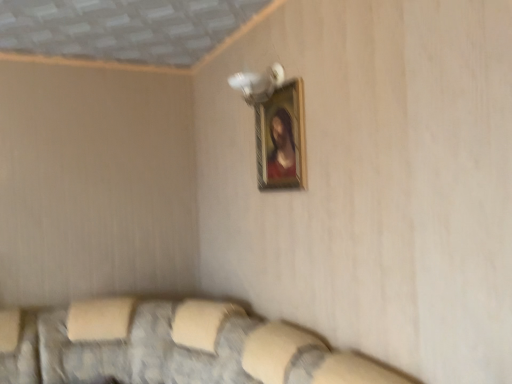
Describe the element at coordinates (281, 138) in the screenshot. I see `wooden frame at upper center` at that location.

Find the location of a particular element. wooden frame at upper center is located at coordinates (281, 138).

Locate an element on the screen. textured fabric couch at lower center is located at coordinates (172, 347).

Describe the element at coordinates (172, 347) in the screenshot. Image resolution: width=512 pixels, height=384 pixels. I see `textured fabric couch at lower center` at that location.

Where is `wooden frame at upper center`? The height and width of the screenshot is (384, 512). wooden frame at upper center is located at coordinates (281, 138).

Can you confirm if wooden frame at upper center is positioned to the left of textured fabric couch at lower center?

In fact, wooden frame at upper center is to the right of textured fabric couch at lower center.

Considering their positions, is wooden frame at upper center located in front of or behind textured fabric couch at lower center?

wooden frame at upper center is positioned farther from the viewer than textured fabric couch at lower center.

In the scene shown: Which is closer to the camera, (283, 91) or (154, 309)?

Point (283, 91).

From the image's perspective, who appears lower, wooden frame at upper center or textured fabric couch at lower center?

textured fabric couch at lower center appears lower in the image.

From a real-world perspective, who is located higher, wooden frame at upper center or textured fabric couch at lower center?

In real-world perspective, wooden frame at upper center is above.

Is wooden frame at upper center wider or thinner than textured fabric couch at lower center?

wooden frame at upper center is thinner than textured fabric couch at lower center.

From their relative heights in the image, would you say wooden frame at upper center is taller or shorter than textured fabric couch at lower center?

wooden frame at upper center is shorter than textured fabric couch at lower center.

Looking at this image, between wooden frame at upper center and textured fabric couch at lower center, which one has larger size?

Bigger between the two is textured fabric couch at lower center.

Is textured fabric couch at lower center completely or partially inside wooden frame at upper center?

Actually, textured fabric couch at lower center is outside wooden frame at upper center.

Are wooden frame at upper center and textured fabric couch at lower center beside each other?

wooden frame at upper center and textured fabric couch at lower center are clearly separated.

Is wooden frame at upper center oriented towards textured fabric couch at lower center?

No.

At what (x,y) coordinates should I click in order to perform the action: click on picture frame above the textured fabric couch at lower center (from a real-world perspective). Please return your answer as a coordinate pair (x, y). This screenshot has height=384, width=512. Looking at the image, I should click on (281, 138).

Is textured fabric couch at lower center to the right of wooden frame at upper center from the viewer's perspective?

In fact, textured fabric couch at lower center is to the left of wooden frame at upper center.

Which is in front, textured fabric couch at lower center or wooden frame at upper center?

textured fabric couch at lower center.

Between point (84, 349) and point (264, 183), which one is positioned in front?

Positioned in front is point (264, 183).

From the image's perspective, relative to wooden frame at upper center, is textured fabric couch at lower center above or below?

From the image's perspective, textured fabric couch at lower center appears below wooden frame at upper center.

From a real-world perspective, is textured fabric couch at lower center positioned under wooden frame at upper center based on gravity?

Yes, from a real-world perspective, textured fabric couch at lower center is below wooden frame at upper center.

Considering the sizes of objects textured fabric couch at lower center and wooden frame at upper center in the image provided, who is wider, textured fabric couch at lower center or wooden frame at upper center?

textured fabric couch at lower center.

Who is taller, textured fabric couch at lower center or wooden frame at upper center?

Standing taller between the two is textured fabric couch at lower center.

Considering the sizes of objects textured fabric couch at lower center and wooden frame at upper center in the image provided, who is bigger, textured fabric couch at lower center or wooden frame at upper center?

Bigger between the two is textured fabric couch at lower center.

Is textured fabric couch at lower center outside of wooden frame at upper center?

Yes, textured fabric couch at lower center is not within wooden frame at upper center.

Is textured fabric couch at lower center directly adjacent to wooden frame at upper center?

textured fabric couch at lower center and wooden frame at upper center are clearly separated.

Is textured fabric couch at lower center facing away from wooden frame at upper center?

No, textured fabric couch at lower center is not facing away from wooden frame at upper center.

Can you tell me how much textured fabric couch at lower center and wooden frame at upper center differ in facing direction?

textured fabric couch at lower center and wooden frame at upper center are facing 0.0336 degrees away from each other.

Locate an element on the screen. The height and width of the screenshot is (384, 512). couch in front of the wooden frame at upper center is located at coordinates (172, 347).

Locate an element on the screen. picture frame lying behind the textured fabric couch at lower center is located at coordinates (281, 138).

Locate an element on the screen. This screenshot has width=512, height=384. couch in front of the wooden frame at upper center is located at coordinates (172, 347).